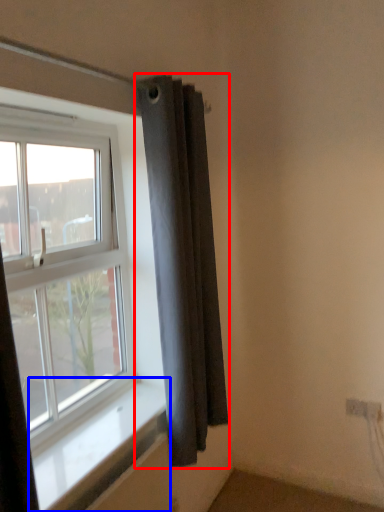
Question: Which object appears closest to the camera in this image, curtain (highlighted by a red box) or window sill (highlighted by a blue box)?

Choices:
 (A) curtain
 (B) window sill

Answer: (B)